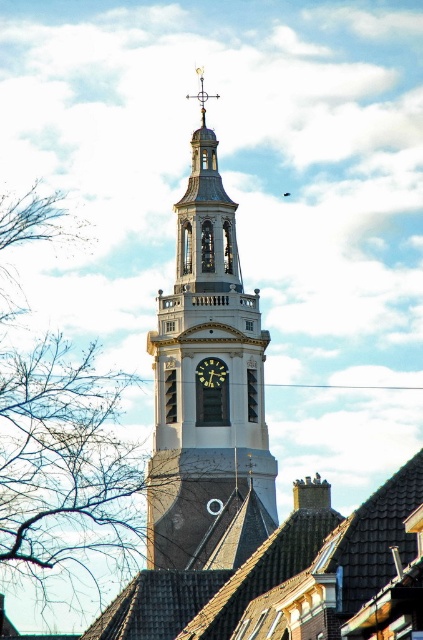
You are standing at the center of the image. Where is the polished brass clock tower at center located relative to your position?

The polished brass clock tower at center is located at point 0.600 on the x axis and 0.473 on the y axis relative to your position.

You are an architect designing a new city square and want to place both the polished brass clock tower at center and the matte black clock at center. Since space is limited, you need to know which one takes up more space. Which object is larger?

The polished brass clock tower at center is bigger than the matte black clock at center, so it takes up more space.

You are standing in the town square and want to take a photo of the polished brass clock tower at center and the bare branches at left. Which object should you focus on first if you want to capture both in a single frame without moving your camera?

You should focus on the polished brass clock tower at center first because it is taller than the bare branches at left, allowing you to frame it properly while ensuring the smaller branches remain in the shot.